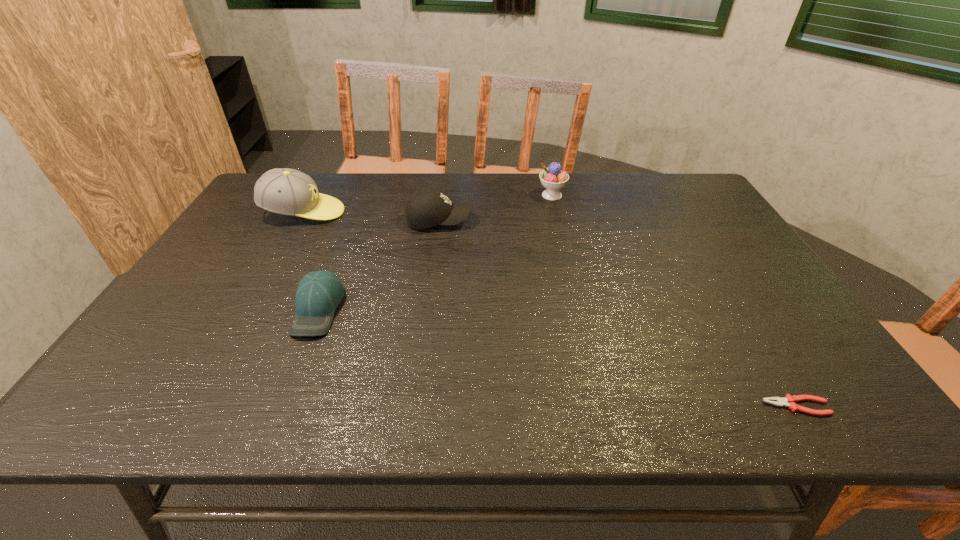
The image size is (960, 540). In order to click on free space at the far edge of the desktop in this screenshot , I will do `click(360, 202)`.

Find the location of a particular element. Image resolution: width=960 pixels, height=540 pixels. vacant space at the right edge of the desktop is located at coordinates (724, 288).

The width and height of the screenshot is (960, 540). What are the coordinates of `blank space at the far right corner of the desktop` in the screenshot? It's located at (708, 201).

This screenshot has height=540, width=960. What are the coordinates of `blank space at the near right corner of the desktop` in the screenshot? It's located at (790, 385).

Where is `free spot between the fourth object from left to right and the nearest object`? This screenshot has height=540, width=960. free spot between the fourth object from left to right and the nearest object is located at coordinates (674, 301).

Find the location of a particular element. vacant space that's between the third shortest object and the nearest object is located at coordinates (618, 313).

Locate an element on the screen. The width and height of the screenshot is (960, 540). free spot between the fourth object from left to right and the nearest baseball cap is located at coordinates (435, 252).

Where is `vacant area between the nearest object and the icecream`? This screenshot has height=540, width=960. vacant area between the nearest object and the icecream is located at coordinates click(x=674, y=301).

Find the location of `unoccupied position between the rightmost object and the second object from right to left`. unoccupied position between the rightmost object and the second object from right to left is located at coordinates (674, 301).

You are a GUI agent. You are given a task and a screenshot of the screen. Output one action in this format:
    pyautogui.click(x=<x>, y=<y>)
    Task: Click on the vacant area that lies between the icecream and the nearest object
    
    Given the screenshot: What is the action you would take?
    674,301